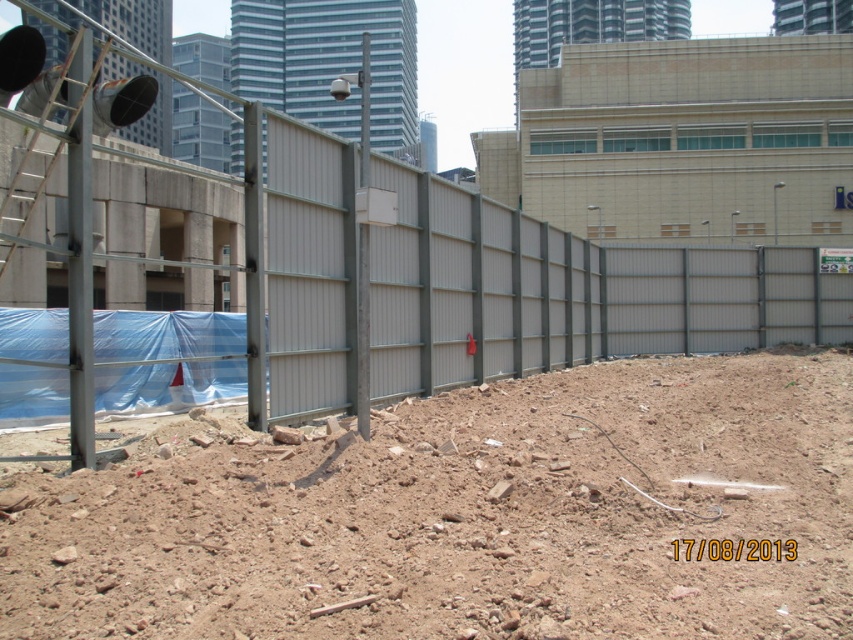
Does brown dirt field at center appear on the left side of metallic gray fence at center?

Yes, brown dirt field at center is to the left of metallic gray fence at center.

How distant is brown dirt field at center from metallic gray fence at center?

4.80 meters

At what (x,y) coordinates should I click in order to perform the action: click on brown dirt field at center. Please return your answer as a coordinate pair (x, y). This screenshot has width=853, height=640. Looking at the image, I should click on (469, 516).